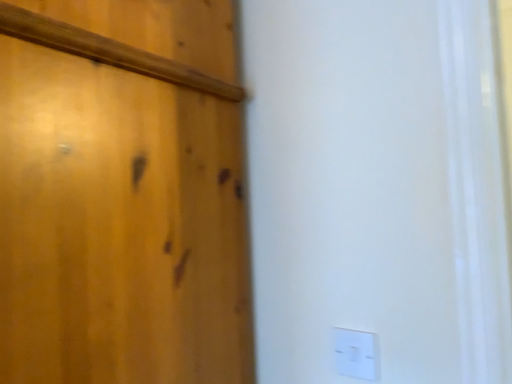
Question: Is wooden door at left further to camera compared to white plastic light switch at lower right?

Choices:
 (A) no
 (B) yes

Answer: (A)

Question: From the image's perspective, is wooden door at left under white plastic light switch at lower right?

Choices:
 (A) yes
 (B) no

Answer: (B)

Question: Is wooden door at left facing towards white plastic light switch at lower right?

Choices:
 (A) yes
 (B) no

Answer: (B)

Question: Is wooden door at left next to white plastic light switch at lower right?

Choices:
 (A) no
 (B) yes

Answer: (A)

Question: Is wooden door at left far away from white plastic light switch at lower right?

Choices:
 (A) yes
 (B) no

Answer: (B)

Question: Can you confirm if wooden door at left is smaller than white plastic light switch at lower right?

Choices:
 (A) yes
 (B) no

Answer: (B)

Question: Is white plastic light switch at lower right aimed at wooden door at left?

Choices:
 (A) no
 (B) yes

Answer: (A)

Question: Is white plastic light switch at lower right outside of wooden door at left?

Choices:
 (A) no
 (B) yes

Answer: (B)

Question: Can you confirm if white plastic light switch at lower right is taller than wooden door at left?

Choices:
 (A) yes
 (B) no

Answer: (B)

Question: From a real-world perspective, is white plastic light switch at lower right physically above wooden door at left?

Choices:
 (A) no
 (B) yes

Answer: (A)

Question: From the image's perspective, is white plastic light switch at lower right beneath wooden door at left?

Choices:
 (A) no
 (B) yes

Answer: (B)

Question: Is white plastic light switch at lower right positioned before wooden door at left?

Choices:
 (A) no
 (B) yes

Answer: (A)

Question: Considering the positions of wooden door at left and white plastic light switch at lower right in the image, is wooden door at left taller or shorter than white plastic light switch at lower right?

Choices:
 (A) tall
 (B) short

Answer: (A)